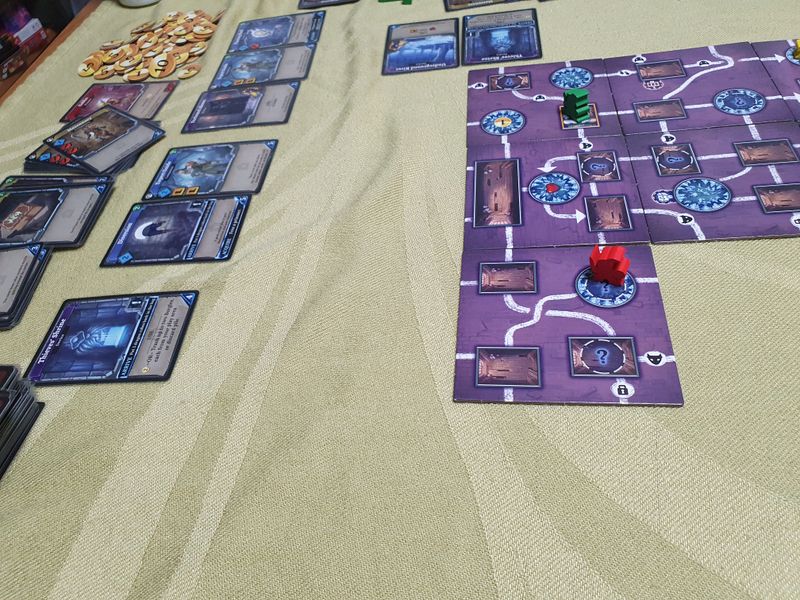
At what (x,y) coordinates should I click in order to perform the action: click on dark tan blanket. Please return your answer as a coordinate pair (x, y). Looking at the image, I should click on (362, 483).